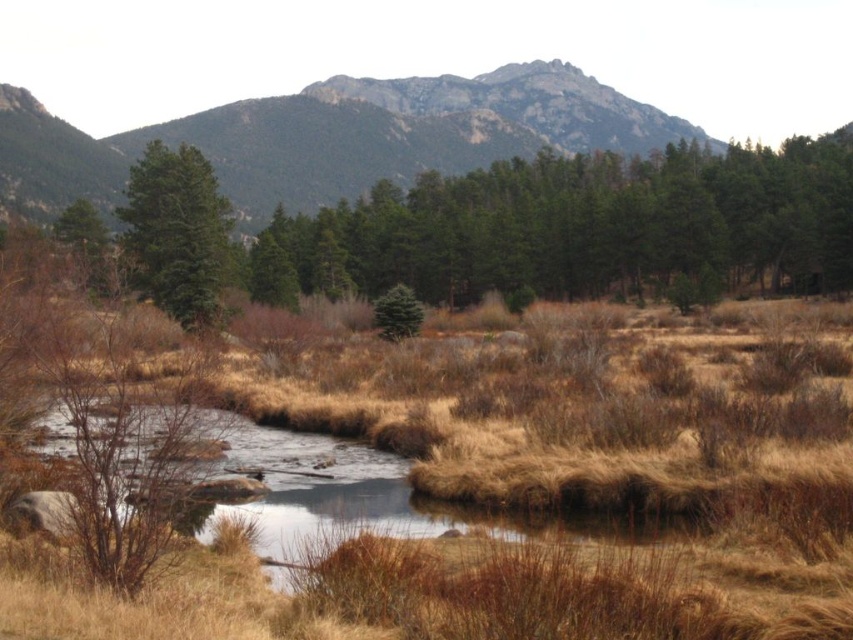
From the picture: You are a hiker looking at the landscape and want to know the direction of the green textured trees at center relative to the gray rocky mountain at upper center. Which side of the mountain do they appear on?

The green textured trees at center are positioned on the right side of the gray rocky mountain at upper center.

Looking at this image, you are an outdoor photographer planning to capture a landscape photo that includes both the gray rocky mountain at upper center and the green matte tree at left. Since you want both subjects to be clearly visible in your composition, which object should you prioritize positioning closer to the camera to ensure it doesn not get lost in the frame?

The green matte tree at left should be positioned closer to the camera because it is smaller in width compared to the gray rocky mountain at upper center, ensuring it remains visible in the frame.